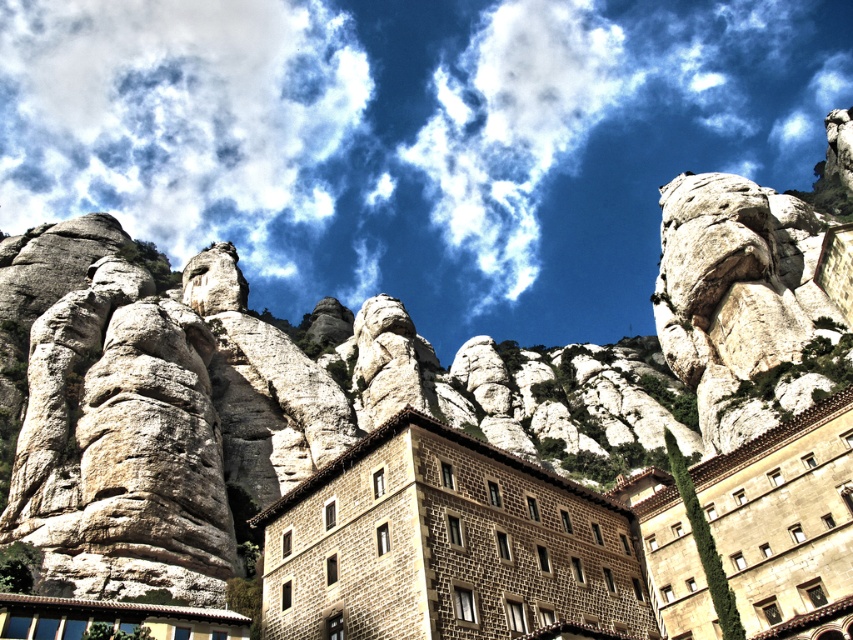
How far apart are white fluffy cloud at upper center and brown stone building at center?

white fluffy cloud at upper center is 377.00 meters away from brown stone building at center.

Between white fluffy cloud at upper center and brown stone building at center, which one appears on the right side from the viewer's perspective?

brown stone building at center

I want to click on white fluffy cloud at upper center, so click(x=413, y=140).